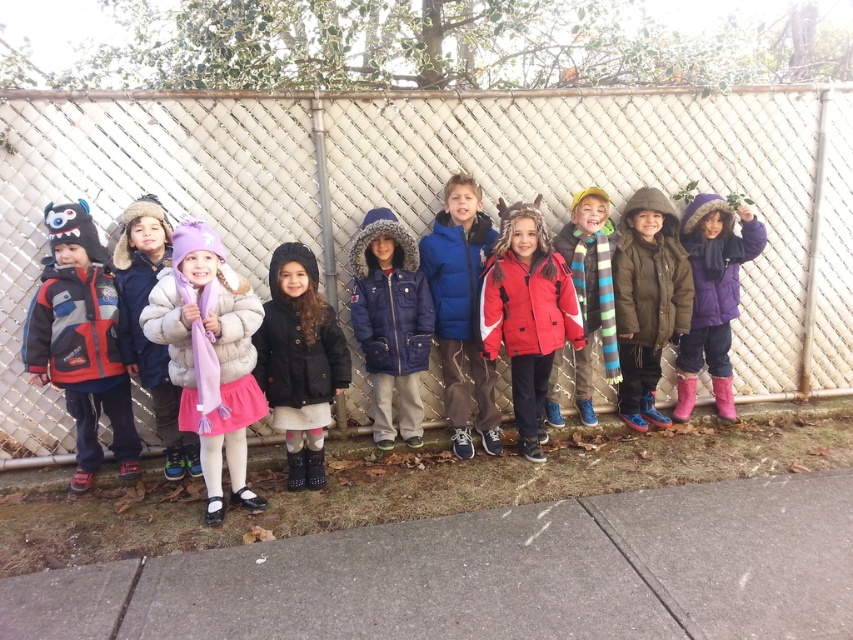
Which is in front, point (234, 321) or point (79, 243)?

Point (234, 321) is more forward.

Between puffy white coat at center and matte red and blue jacket at left, which one has less height?

puffy white coat at center

Between point (225, 269) and point (54, 298), which one is positioned behind?

The point (54, 298) is more distant.

Identify the location of puffy white coat at center. (209, 356).

How far apart are purple fuzzy coat at right and fuzzy pink coat at center?

A distance of 3.05 meters exists between purple fuzzy coat at right and fuzzy pink coat at center.

Which is in front, point (747, 218) or point (142, 195)?

Positioned in front is point (142, 195).

In order to click on purple fuzzy coat at right in this screenshot , I will do `click(712, 296)`.

Does black wool coat at center have a lesser width compared to fuzzy pink coat at center?

In fact, black wool coat at center might be wider than fuzzy pink coat at center.

Does point (323, 365) lie in front of point (117, 289)?

Yes.

Identify the location of black wool coat at center. This screenshot has height=640, width=853. (300, 360).